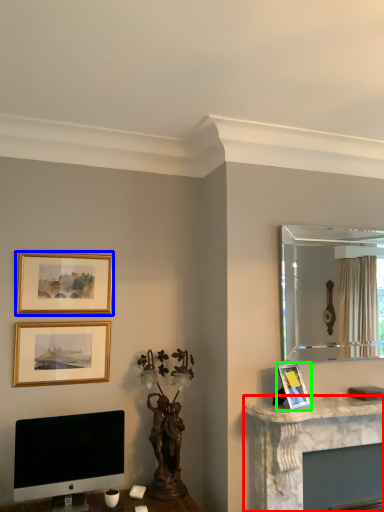
Question: Based on their relative distances, which object is nearer to computer desk (highlighted by a red box)? Choose from picture frame (highlighted by a blue box) and picture frame (highlighted by a green box).

Choices:
 (A) picture frame
 (B) picture frame

Answer: (B)